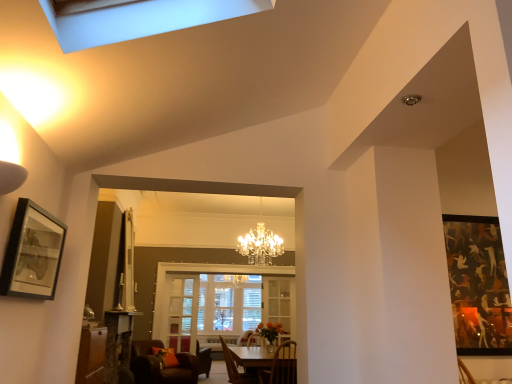
Where is `brown leather chair at lower left, the 3th chair positioned from the front`? Image resolution: width=512 pixels, height=384 pixels. brown leather chair at lower left, the 3th chair positioned from the front is located at coordinates (159, 365).

The image size is (512, 384). What do you see at coordinates (267, 363) in the screenshot?
I see `wooden table at center` at bounding box center [267, 363].

What do you see at coordinates (281, 366) in the screenshot? The width and height of the screenshot is (512, 384). I see `wooden chair at lower center, placed as the 3th chair when sorted from left to right` at bounding box center [281, 366].

In order to click on matte black picture frame at left in this screenshot , I will do `click(32, 253)`.

Is clear glass door at center further to camera compared to wooden chair at lower center, which appears as the 3th chair when viewed from the back?

Yes, the depth of clear glass door at center is greater than that of wooden chair at lower center, which appears as the 3th chair when viewed from the back.

Is clear glass door at center next to wooden chair at lower center, placed as the 3th chair when sorted from left to right?

No, clear glass door at center is not beside wooden chair at lower center, placed as the 3th chair when sorted from left to right.

How different are the orientations of clear glass door at center and wooden chair at lower center, placed as the 3th chair when sorted from left to right, in degrees?

The angle between the facing direction of clear glass door at center and the facing direction of wooden chair at lower center, placed as the 3th chair when sorted from left to right, is 180 degrees.

Considering the sizes of objects clear glass door at center and wooden chair at lower center, placed as the 3th chair when sorted from left to right, in the image provided, who is wider, clear glass door at center or wooden chair at lower center, placed as the 3th chair when sorted from left to right,?

With larger width is wooden chair at lower center, placed as the 3th chair when sorted from left to right.

Considering the relative sizes of matte black picture frame at left and brown leather chair at lower left, which is the first chair in left-to-right order, in the image provided, is matte black picture frame at left shorter than brown leather chair at lower left, which is the first chair in left-to-right order,?

Yes, matte black picture frame at left is shorter than brown leather chair at lower left, which is the first chair in left-to-right order.

Considering the relative sizes of matte black picture frame at left and brown leather chair at lower left, which is the 1th chair in back-to-front order, in the image provided, is matte black picture frame at left bigger than brown leather chair at lower left, which is the 1th chair in back-to-front order,?

No.

Is matte black picture frame at left facing towards brown leather chair at lower left, arranged as the third chair when viewed from the right?

No, matte black picture frame at left is not facing towards brown leather chair at lower left, arranged as the third chair when viewed from the right.

Based on the photo, considering the relative sizes of matte black picture frame at left and brown leather chair at lower left, which is the 1th chair in back-to-front order, in the image provided, is matte black picture frame at left wider than brown leather chair at lower left, which is the 1th chair in back-to-front order,?

No.

Can you see clear glass door at center touching wooden table at center?

No, clear glass door at center is not making contact with wooden table at center.

Between clear glass door at center and wooden table at center, which one has larger width?

Wider between the two is wooden table at center.

From a real-world perspective, which is physically above, clear glass door at center or wooden table at center?

clear glass door at center, from a real-world perspective.

Which object is more forward, clear glass door at center or wooden table at center?

wooden table at center.

From the picture: From a real-world perspective, between clear glass door at center and matte black picture frame at left, who is vertically lower?

clear glass door at center.

Would you say clear glass door at center is a long distance from matte black picture frame at left?

Absolutely, clear glass door at center is distant from matte black picture frame at left.

From the image's perspective, is clear glass door at center on top of matte black picture frame at left?

No, from the image's perspective, clear glass door at center is not over matte black picture frame at left.

Based on the photo, does clear glass door at center have a greater width compared to matte black picture frame at left?

Yes, clear glass door at center is wider than matte black picture frame at left.

From the image's perspective, between wooden chair at lower center, which is the 2th chair from back to front, and wooden chair at lower center, placed as the 3th chair when sorted from left to right, which one is located above?

wooden chair at lower center, placed as the 3th chair when sorted from left to right, from the image's perspective.

Which object is positioned more to the left, wooden chair at lower center, the 2th chair viewed from the front, or wooden chair at lower center, which appears as the 3th chair when viewed from the back?

Positioned to the left is wooden chair at lower center, the 2th chair viewed from the front.

Is wooden chair at lower center, the 2th chair viewed from the front, shorter than wooden chair at lower center, which appears as the first chair when viewed from the front?

Incorrect, the height of wooden chair at lower center, the 2th chair viewed from the front, does not fall short of that of wooden chair at lower center, which appears as the first chair when viewed from the front.

Does wooden chair at lower center, which appears as the second chair when viewed from the left, have a smaller size compared to wooden chair at lower center, which appears as the first chair when viewed from the front?

No.

From a real-world perspective, between wooden chair at lower center, placed as the 3th chair when sorted from left to right, and brown leather chair at lower left, the 3th chair positioned from the front, who is vertically lower?

brown leather chair at lower left, the 3th chair positioned from the front, is physically lower.

From the image's perspective, does wooden chair at lower center, placed as the 3th chair when sorted from left to right, appear lower than brown leather chair at lower left, which is the 1th chair in back-to-front order?

No.

Is point (284, 348) positioned after point (172, 376)?

Yes, point (284, 348) is farther from viewer.

Between wooden chair at lower center, which appears as the first chair when viewed from the front, and brown leather chair at lower left, which is the 1th chair in back-to-front order, which one has less height?

Standing shorter between the two is wooden chair at lower center, which appears as the first chair when viewed from the front.

Considering the positions of objects wooden chair at lower center, which appears as the first chair when viewed from the front, and wooden table at center in the image provided, who is more to the left, wooden chair at lower center, which appears as the first chair when viewed from the front, or wooden table at center?

From the viewer's perspective, wooden table at center appears more on the left side.

In the scene shown: From a real-world perspective, is wooden chair at lower center, which appears as the 3th chair when viewed from the back, positioned over wooden table at center based on gravity?

Indeed, from a real-world perspective, wooden chair at lower center, which appears as the 3th chair when viewed from the back, stands above wooden table at center.

Is wooden chair at lower center, the 1th chair in the right-to-left sequence, not near wooden table at center?

No, wooden chair at lower center, the 1th chair in the right-to-left sequence, is in close proximity to wooden table at center.

Where is `the 2nd chair above when counting from the clear glass door at center (from the image's perspective)`? The width and height of the screenshot is (512, 384). the 2nd chair above when counting from the clear glass door at center (from the image's perspective) is located at coordinates (281, 366).

Where is `picture frame that is on the right side of brown leather chair at lower left, arranged as the third chair when viewed from the right`? The height and width of the screenshot is (384, 512). picture frame that is on the right side of brown leather chair at lower left, arranged as the third chair when viewed from the right is located at coordinates (32, 253).

Which object lies further to the anchor point brown leather chair at lower left, arranged as the third chair when viewed from the right, matte black picture frame at left or wooden table at center?

matte black picture frame at left.

Based on the photo, when comparing their distances from matte black picture frame at left, does clear glass door at center or brown leather chair at lower left, arranged as the third chair when viewed from the right, seem further?

Among the two, clear glass door at center is located further to matte black picture frame at left.

Which object lies further to the anchor point clear glass door at center, matte black picture frame at left or brown leather chair at lower left, the 3th chair positioned from the front?

matte black picture frame at left is further to clear glass door at center.

Based on the photo, considering their positions, is brown leather chair at lower left, which is the first chair in left-to-right order, positioned closer to wooden chair at lower center, the 2th chair viewed from the front, than wooden chair at lower center, the 1th chair in the right-to-left sequence?

Among the two, wooden chair at lower center, the 1th chair in the right-to-left sequence, is located nearer to wooden chair at lower center, the 2th chair viewed from the front.

Looking at the image, which one is located further to matte black picture frame at left, brown leather chair at lower left, which is the first chair in left-to-right order, or wooden chair at lower center, which is the 2th chair from back to front?

brown leather chair at lower left, which is the first chair in left-to-right order, is further to matte black picture frame at left.

From the image, which object appears to be farther from brown leather chair at lower left, which is the 1th chair in back-to-front order, wooden chair at lower center, which is the 2th chair from back to front, or clear glass door at center?

Based on the image, wooden chair at lower center, which is the 2th chair from back to front, appears to be further to brown leather chair at lower left, which is the 1th chair in back-to-front order.

Which object lies further to the anchor point clear glass door at center, wooden chair at lower center, which appears as the first chair when viewed from the front, or wooden table at center?

Among the two, wooden chair at lower center, which appears as the first chair when viewed from the front, is located further to clear glass door at center.

Estimate the real-world distances between objects in this image. Which object is further from wooden table at center, wooden chair at lower center, which appears as the second chair when viewed from the left, or matte black picture frame at left?

matte black picture frame at left lies further to wooden table at center than the other object.

Identify the location of table located between wooden chair at lower center, the 1th chair in the right-to-left sequence, and clear glass door at center in the depth direction. Image resolution: width=512 pixels, height=384 pixels. (267, 363).

Where is `table between matte black picture frame at left and brown leather chair at lower left, the 3th chair positioned from the front, from front to back`? The width and height of the screenshot is (512, 384). table between matte black picture frame at left and brown leather chair at lower left, the 3th chair positioned from the front, from front to back is located at coordinates (267, 363).

Locate an element on the screen. The image size is (512, 384). chair positioned between matte black picture frame at left and wooden chair at lower center, which is the 2th chair from back to front, from near to far is located at coordinates (281, 366).

Locate an element on the screen. chair positioned between wooden chair at lower center, the 2th chair in the right-to-left sequence, and clear glass door at center from near to far is located at coordinates (159, 365).